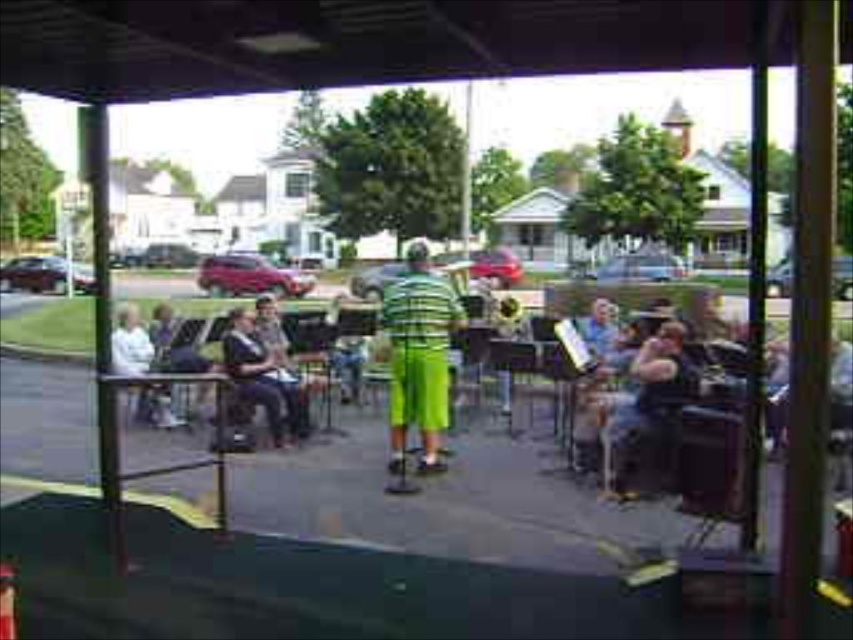
Question: Does green striped shirt at center lie in front of white fabric shirt at left?

Choices:
 (A) no
 (B) yes

Answer: (B)

Question: Does green striped shirt at center appear over dark blue fabric jacket at center?

Choices:
 (A) yes
 (B) no

Answer: (A)

Question: Among these objects, which one is nearest to the camera?

Choices:
 (A) white fabric shirt at left
 (B) dark blue fabric jacket at center

Answer: (B)

Question: Which point is closer to the camera?

Choices:
 (A) white fabric shirt at left
 (B) green striped shirt at center
 (C) dark blue fabric jacket at center

Answer: (B)

Question: Which point is closer to the camera?

Choices:
 (A) green striped shirt at center
 (B) dark blue fabric jacket at center

Answer: (A)

Question: Does dark blue fabric jacket at center have a lesser width compared to white fabric shirt at left?

Choices:
 (A) yes
 (B) no

Answer: (B)